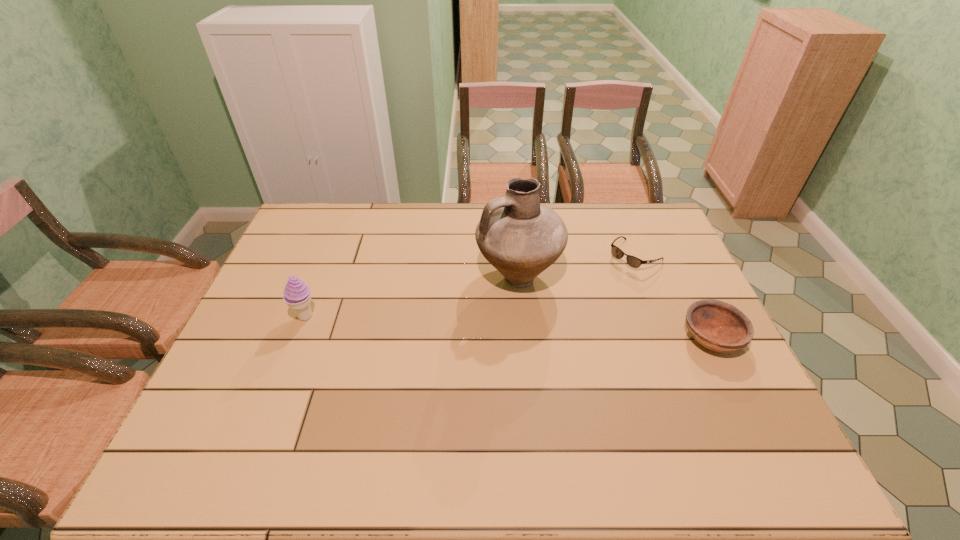
This screenshot has width=960, height=540. Find the location of `vacant space located on the front-facing side of the sunglasses`. vacant space located on the front-facing side of the sunglasses is located at coordinates (582, 299).

At what (x,y) coordinates should I click in order to perform the action: click on free location located on the handle side of the pitcher. Please return your answer as a coordinate pair (x, y). The image size is (960, 540). Looking at the image, I should click on (387, 362).

This screenshot has height=540, width=960. Identify the location of vacant point located on the handle side of the pitcher. tap(396, 356).

The image size is (960, 540). In order to click on vacant space situated 0.230m on the handle side of the pitcher in this screenshot , I will do `click(426, 336)`.

Where is `object that is at the far edge`? This screenshot has height=540, width=960. object that is at the far edge is located at coordinates (632, 261).

Where is `object that is at the left edge`? object that is at the left edge is located at coordinates (297, 295).

This screenshot has height=540, width=960. Find the location of `bowl that is at the right edge`. bowl that is at the right edge is located at coordinates (721, 327).

Image resolution: width=960 pixels, height=540 pixels. In order to click on sunglasses at the right edge in this screenshot , I will do `click(632, 261)`.

You are a GUI agent. You are given a task and a screenshot of the screen. Output one action in this format:
    pyautogui.click(x=<x>, y=<y>)
    Task: Click on the object that is at the far right corner
    The height and width of the screenshot is (540, 960).
    Given the screenshot: What is the action you would take?
    pyautogui.click(x=632, y=261)

Identify the location of vacant area at the far edge. The width and height of the screenshot is (960, 540). (379, 239).